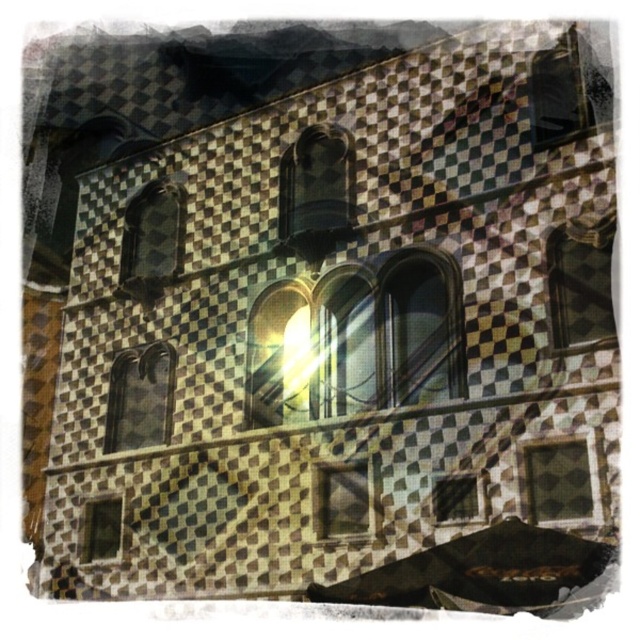
You are standing 60 meters away from the building. Can you safely approach the matte glass window at center left without exceeding the 66.30 meters safety distance limit?

The distance between the matte glass window at center left and the viewer is 66.30 meters. Since you are already standing 60 meters away, you can approach closer by up to 6.30 meters and still remain within the safety limit.